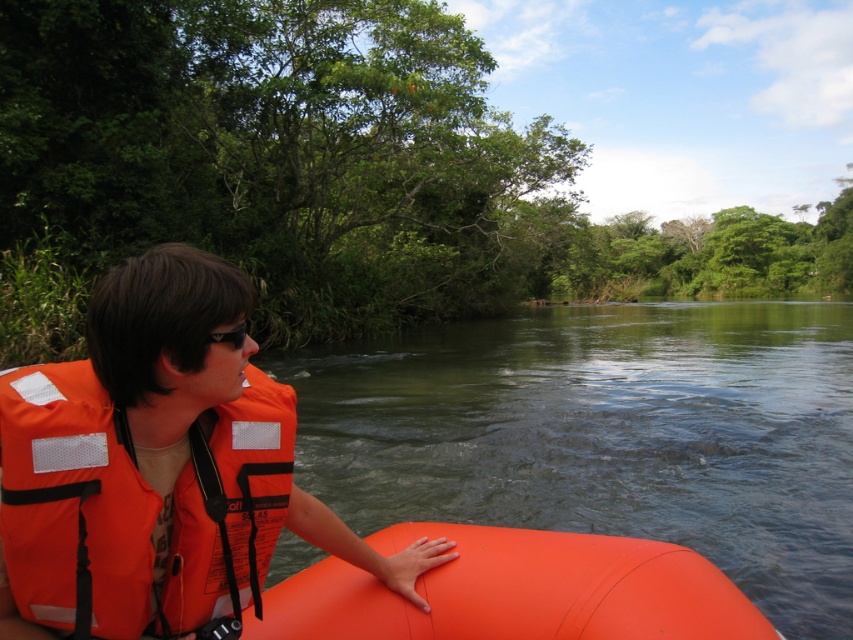
Question: Which of the following is the farthest from the observer?

Choices:
 (A) black plastic goggles at upper left
 (B) green smooth water at center

Answer: (B)

Question: Which point is farther from the camera taking this photo?

Choices:
 (A) coord(61,516)
 (B) coord(229,337)
 (C) coord(322,628)
 (D) coord(585,531)

Answer: (D)

Question: Where is green smooth water at center located in relation to black plastic goggles at upper left in the image?

Choices:
 (A) below
 (B) above

Answer: (B)

Question: Does green smooth water at center come behind orange fabric life jacket at left?

Choices:
 (A) yes
 (B) no

Answer: (A)

Question: Can you confirm if green smooth water at center is positioned below orange rubber boat at center?

Choices:
 (A) yes
 (B) no

Answer: (B)

Question: Considering the real-world distances, which object is farthest from the green smooth water at center?

Choices:
 (A) orange fabric life jacket at left
 (B) orange life vest at left
 (C) black plastic goggles at upper left
 (D) orange rubber boat at center

Answer: (C)